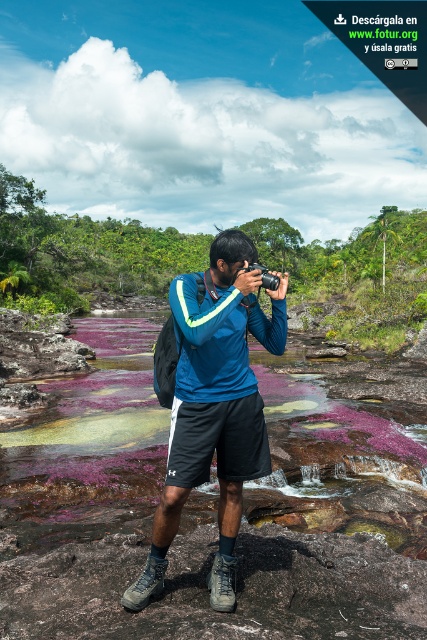
Question: Which object is closer to the camera taking this photo?

Choices:
 (A) purple mossy rocks at center
 (B) black plastic camera at center
 (C) blue fabric shirt at center

Answer: (C)

Question: Estimate the real-world distances between objects in this image. Which object is farther from the black plastic camera at center?

Choices:
 (A) blue fabric shirt at center
 (B) purple mossy rocks at center

Answer: (B)

Question: Which object is positioned closest to the blue fabric shirt at center?

Choices:
 (A) purple mossy rocks at center
 (B) black plastic camera at center

Answer: (B)

Question: In this image, where is purple mossy rocks at center located relative to blue fabric shirt at center?

Choices:
 (A) right
 (B) left

Answer: (B)

Question: Is purple mossy rocks at center wider than black plastic camera at center?

Choices:
 (A) no
 (B) yes

Answer: (B)

Question: Does purple mossy rocks at center lie behind blue fabric shirt at center?

Choices:
 (A) yes
 (B) no

Answer: (A)